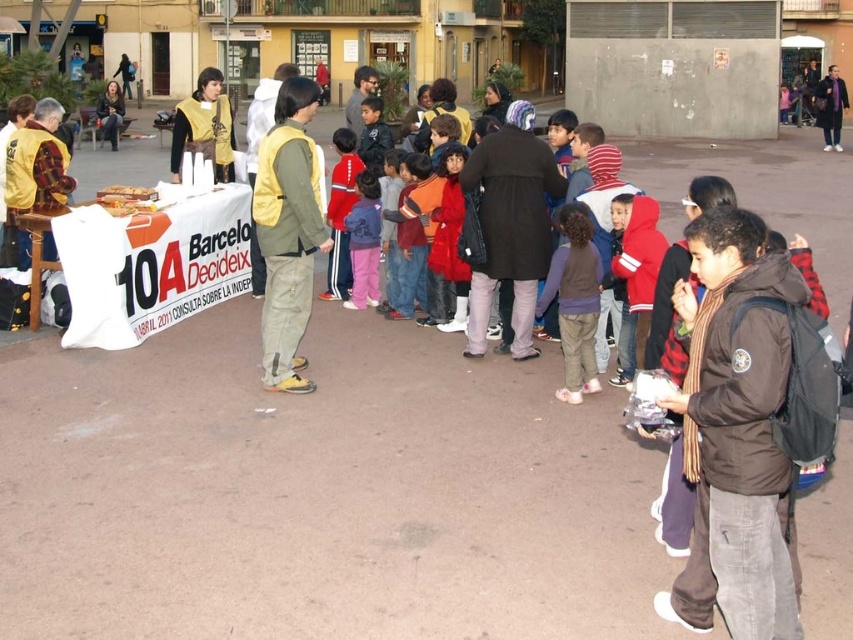
Is point (48, 108) positioned before point (833, 80)?

That is True.

Is matte yellow vest at left behind purple scarf at center?

No, matte yellow vest at left is in front of purple scarf at center.

I want to click on matte yellow vest at left, so click(38, 164).

Find the location of a particular element. matte yellow vest at left is located at coordinates (38, 164).

Is point (173, 172) positioned in front of point (834, 108)?

Yes, point (173, 172) is closer to viewer.

Measure the distance between matte gold vest at center and purple scarf at center.

70.05 feet

Image resolution: width=853 pixels, height=640 pixels. What do you see at coordinates (204, 125) in the screenshot?
I see `matte gold vest at center` at bounding box center [204, 125].

Find the location of a particular element. The image size is (853, 640). matte gold vest at center is located at coordinates (204, 125).

Does brown matte jacket at lower right have a lesser height compared to yellow fabric vest at center?

Indeed, brown matte jacket at lower right has a lesser height compared to yellow fabric vest at center.

Does brown matte jacket at lower right have a smaller size compared to yellow fabric vest at center?

Yes.

Is point (729, 593) positioned after point (300, 180)?

No, (729, 593) is in front of (300, 180).

In order to click on brown matte jacket at lower right in this screenshot , I will do `click(735, 433)`.